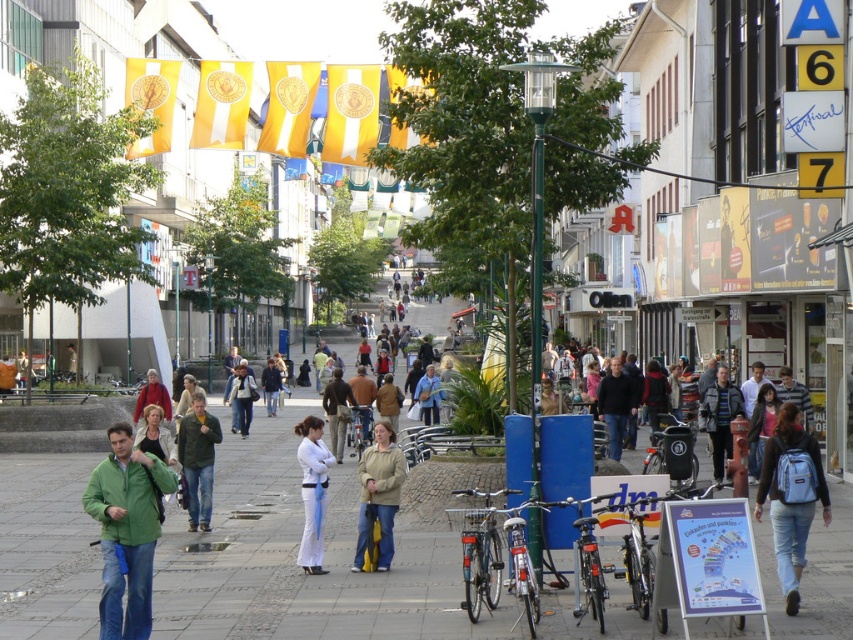
In the scene shown: You are standing at the center of the street in the lively urban scene. You see a green matte jacket at lower left located at point [126,531]. If you want to walk directly to that point, which direction should you head towards?

You should head towards the lower left direction to reach the green matte jacket at lower left located at point [126,531].

You are standing at the point marked by the coordinates (379, 493) in the image. What object is located exactly at that point?

The light brown leather jacket at center is located exactly at the point marked by the coordinates (379, 493).

You are a delivery person who needs to deliver a package to the exact location of the light brown leather jacket at center. According to the coordinates provided, where should you place the package?

The package should be placed at the coordinates point (379, 493) where the light brown leather jacket at center is located.